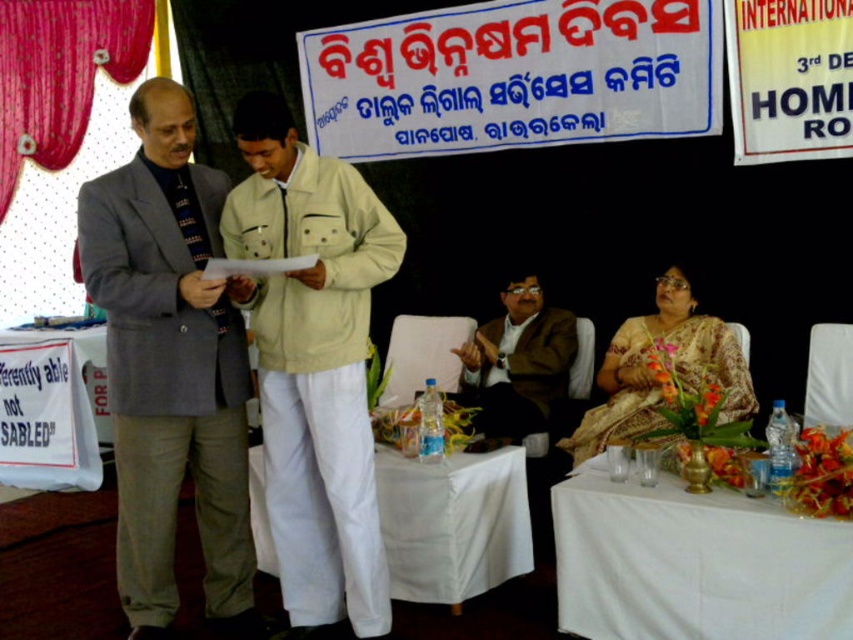
You are an event organizer who needs to place a 70 cm wide decorative piece between the white cloth table at lower right and the beige floral saree at lower right. Can you fit it there?

The distance between the white cloth table at lower right and the beige floral saree at lower right is 80.98 centimeters. Since the decorative piece is 70 cm wide, it can fit as there is enough space between them.

You are a photographer at the event and need to frame a closeup shot of both the gray woolen suit at left and the beige floral saree at lower right in the same frame. Considering their sizes, which one might require more zoom adjustment to fit into the frame?

The beige floral saree at lower right requires more zoom adjustment because it occupies more space than the gray woolen suit at left, so to include both in the frame, the photographer would need to adjust the zoom to accommodate its larger size.

You are an event photographer who needs to capture a clear shot of both the gray woolen suit at left and the beige floral saree at lower right. Based on their positions, which one is closer to the camera?

The gray woolen suit at left is positioned over the beige floral saree at lower right, meaning it is closer to the camera.